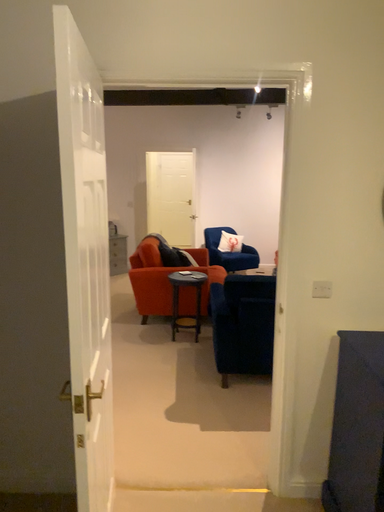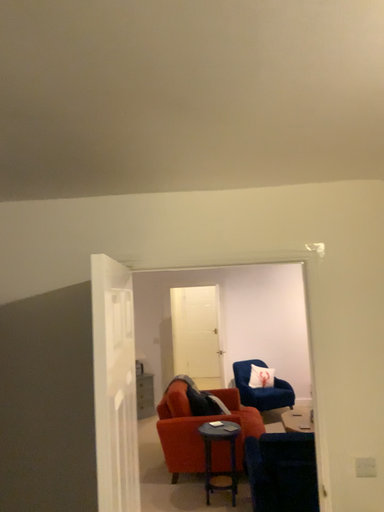
Question: Which way did the camera rotate in the video?

Choices:
 (A) rotated downward
 (B) rotated upward

Answer: (B)